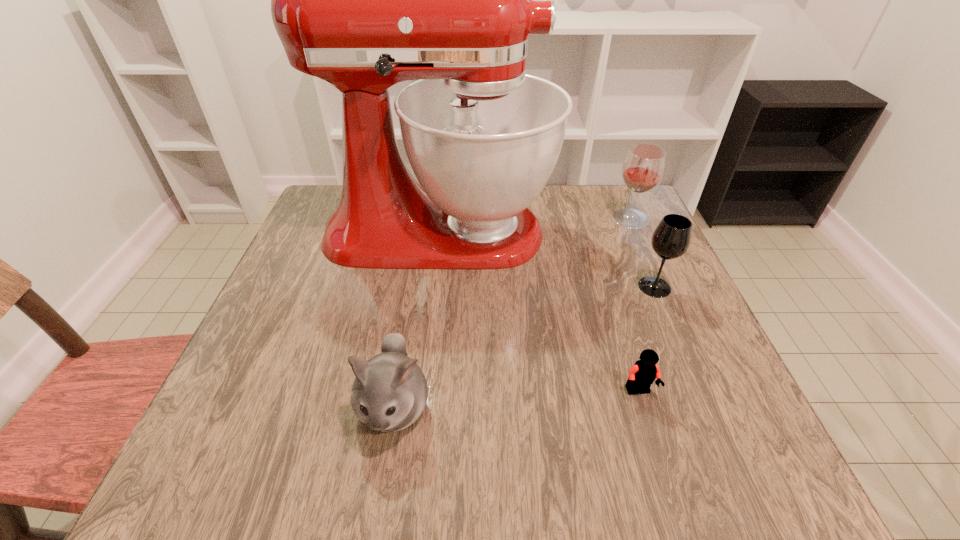
Identify the location of mixer. (363, 0).

Image resolution: width=960 pixels, height=540 pixels. I want to click on the farther wineglass, so click(x=643, y=168).

Locate an element on the screen. This screenshot has height=540, width=960. the nearer wineglass is located at coordinates [671, 239].

Where is `the fourth tallest object`? The height and width of the screenshot is (540, 960). the fourth tallest object is located at coordinates (389, 393).

In order to click on Lego in this screenshot , I will do `click(644, 372)`.

Find the location of a particular element. This screenshot has width=960, height=540. the shortest object is located at coordinates (644, 372).

You are a GUI agent. You are given a task and a screenshot of the screen. Output one action in this format:
    pyautogui.click(x=<x>, y=<y>)
    Task: Click on the vacant space situated at the attachment hub of the mixer
    
    Given the screenshot: What is the action you would take?
    pyautogui.click(x=577, y=233)

Identify the location of vacant space located 0.160m on the left of the farther wineglass. (552, 219).

Locate an element on the screen. The height and width of the screenshot is (540, 960). vacant space located on the back of the nearer wineglass is located at coordinates (629, 228).

Locate an element on the screen. The height and width of the screenshot is (540, 960). vacant space located 0.070m on the front-facing side of the third object from left to right is located at coordinates (654, 439).